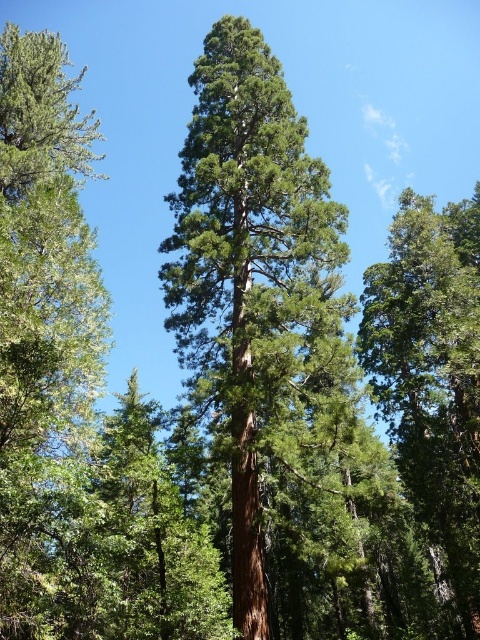
Question: Considering the relative positions of green matte tree at left and green matte tree at center in the image provided, where is green matte tree at left located with respect to green matte tree at center?

Choices:
 (A) left
 (B) right

Answer: (A)

Question: Which object is closer to the camera taking this photo?

Choices:
 (A) green matte tree at center
 (B) green matte tree at left
 (C) green rough bark tree at center

Answer: (B)

Question: Which point is closer to the camera taking this photo?

Choices:
 (A) (22, 44)
 (B) (417, 358)

Answer: (A)

Question: Where is green rough bark tree at center located in relation to green matte tree at left in the image?

Choices:
 (A) right
 (B) left

Answer: (A)

Question: Which point is farther from the camera taking this photo?

Choices:
 (A) (35, 180)
 (B) (368, 296)

Answer: (B)

Question: Can you confirm if green matte tree at left is positioned above green matte tree at center?

Choices:
 (A) no
 (B) yes

Answer: (B)